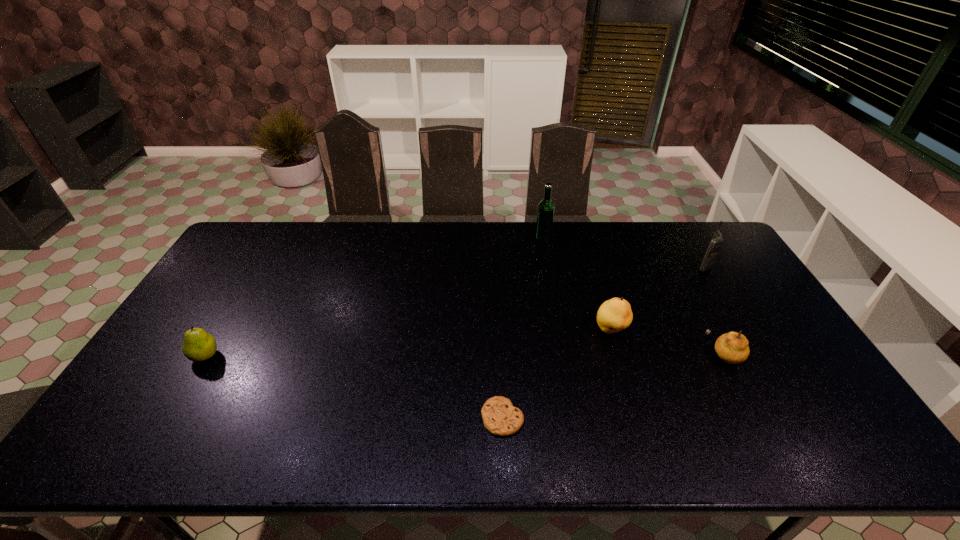
At what (x,y) coordinates should I click in order to perform the action: click on object that is at the left edge. Please return your answer as a coordinate pair (x, y). The width and height of the screenshot is (960, 540). Looking at the image, I should click on (198, 345).

Where is `object at the right edge`? This screenshot has height=540, width=960. object at the right edge is located at coordinates (717, 240).

What are the coordinates of `object that is at the far right corner` in the screenshot? It's located at (717, 240).

This screenshot has height=540, width=960. Find the location of `free space at the far edge`. free space at the far edge is located at coordinates (458, 222).

Where is `vacant space at the near edge of the desktop`? The height and width of the screenshot is (540, 960). vacant space at the near edge of the desktop is located at coordinates pos(472,440).

Locate an element on the screen. vacant area at the left edge of the desktop is located at coordinates (183, 406).

In the image, there is a desktop. Identify the location of free space at the right edge. (842, 411).

What are the coordinates of `free point at the far right corner` in the screenshot? It's located at (732, 261).

The image size is (960, 540). Find the location of `free space between the leftmost pear and the rightmost pear`. free space between the leftmost pear and the rightmost pear is located at coordinates (465, 355).

Locate an element on the screen. Image resolution: width=960 pixels, height=540 pixels. vacant region between the leftmost pear and the shortest object is located at coordinates pyautogui.click(x=354, y=387).